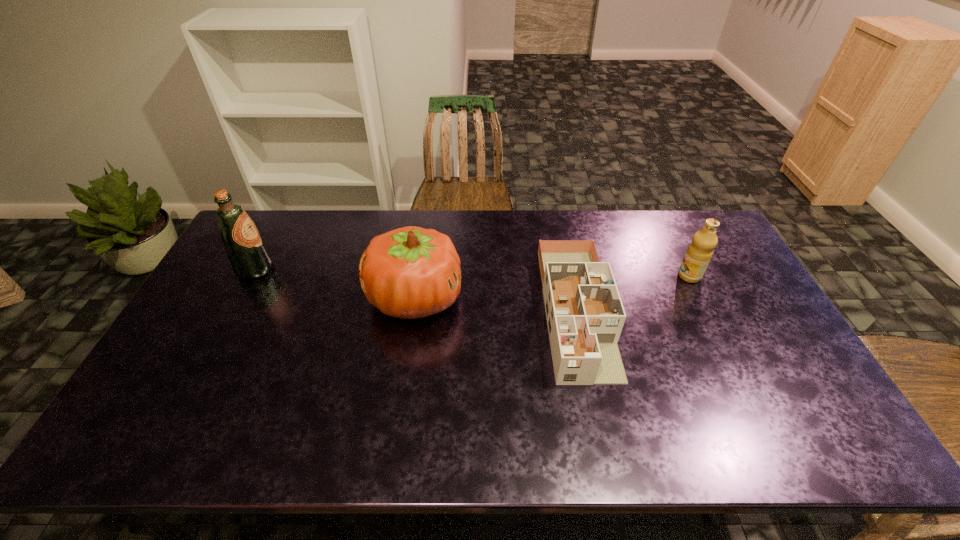
Where is `the closest object relative to the leftmost object`? The height and width of the screenshot is (540, 960). the closest object relative to the leftmost object is located at coordinates (410, 272).

I want to click on vacant space that satisfies the following two spatial constraints: 1. on the label of the third tallest object; 2. at the entrance of the second object from right to left, so click(706, 310).

Image resolution: width=960 pixels, height=540 pixels. Identify the location of free space that satisfies the following two spatial constraints: 1. on the label of the rightmost object; 2. at the entrance of the shortest object. (706, 310).